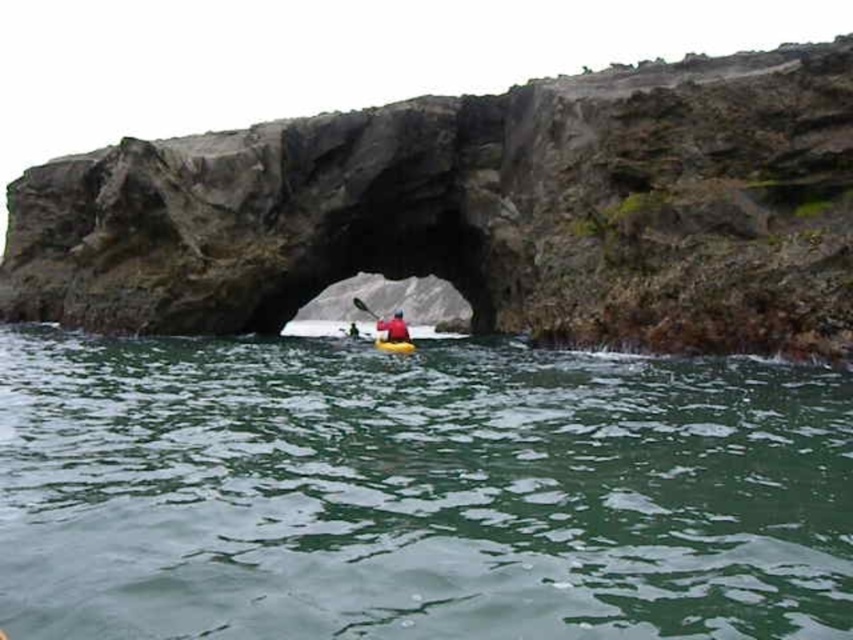
You are standing on the beach and see the green water at center and the yellow plastic paddle at center. Which object is taller?

The yellow plastic paddle at center is taller than the green water at center.

You are standing on the beach and see both the yellow plastic canoe at center and the yellow kayak at center. Which one is closer to you?

The yellow plastic canoe at center is closer to you because it is in front of the yellow kayak at center.

You are standing on the rocky shore looking at the green water at center and the red fabric kayak at center. Which object is nearer to you?

The green water at center is closer to the viewer than the red fabric kayak at center.